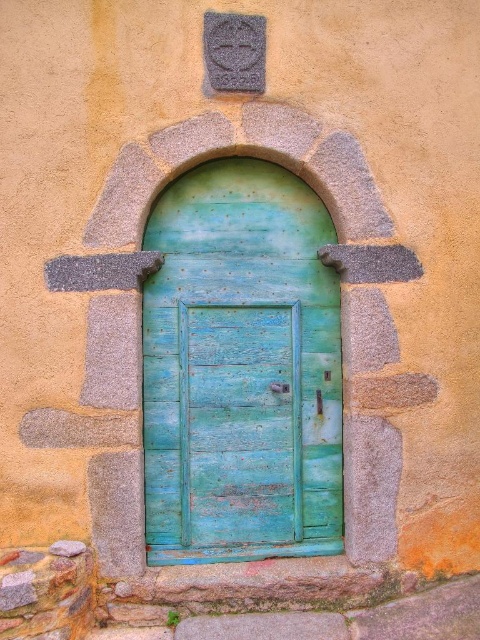
You are standing in front of the rustic wooden door within the stone archway. There are two points marked on the door. One is at coordinate point (333, 388) and the other is at coordinate point (296, 365). Which point is closer to you?

Point (296, 365) is closer to you because it is in front of point (333, 388).